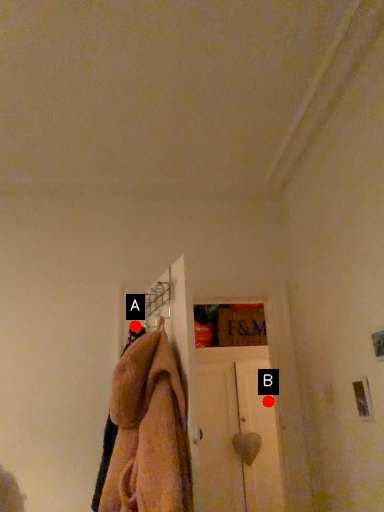
Question: Two points are circled on the image, labeled by A and B beside each circle. Among these points, which one is nearest to the camera?

Choices:
 (A) A is closer
 (B) B is closer

Answer: (A)